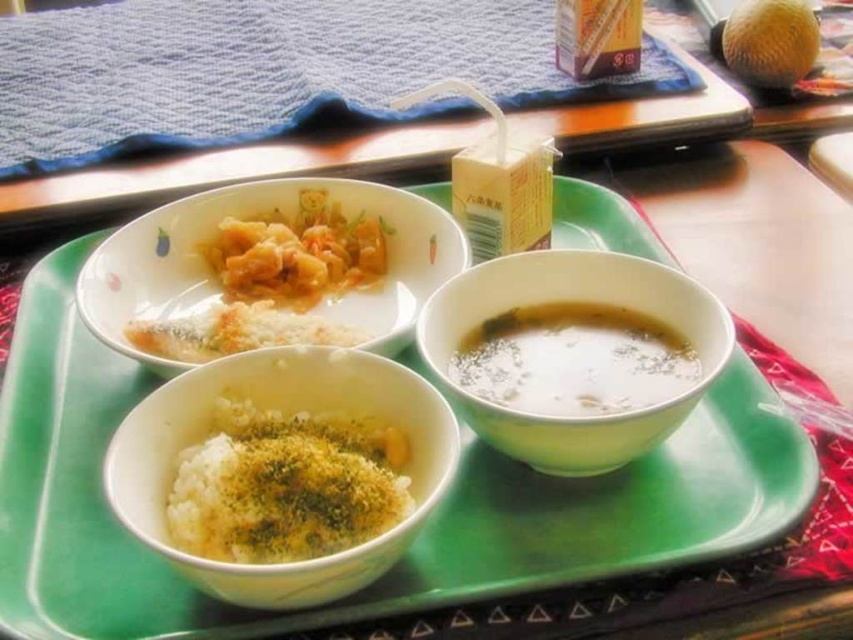
Question: Which is farther from the white crumbly rice at center?

Choices:
 (A) white matte rice bowl at lower left
 (B) white creamy soup at bottom right
 (C) green ceramic bowl at lower right

Answer: (C)

Question: Can you confirm if white rice with green seasoning at bottom left is smaller than white creamy soup at bottom right?

Choices:
 (A) yes
 (B) no

Answer: (A)

Question: From the image, what is the correct spatial relationship of green ceramic bowl at lower right in relation to white glossy bowl at upper left?

Choices:
 (A) right
 (B) left

Answer: (A)

Question: Which object appears farthest from the camera in this image?

Choices:
 (A) green ceramic bowl at lower right
 (B) green ceramic tray at center

Answer: (A)

Question: Which object is farther from the camera taking this photo?

Choices:
 (A) green ceramic tray at center
 (B) white matte rice bowl at lower left
 (C) green ceramic bowl at lower right

Answer: (C)

Question: Can you confirm if green ceramic tray at center is positioned above white crumbly rice at center?

Choices:
 (A) yes
 (B) no

Answer: (B)